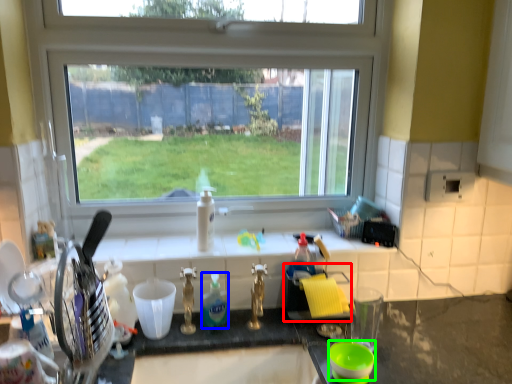
Question: Estimate the real-world distances between objects in this image. Which object is farther from appliance (highlighted by a red box), bottle (highlighted by a blue box) or basin (highlighted by a green box)?

Choices:
 (A) bottle
 (B) basin

Answer: (B)